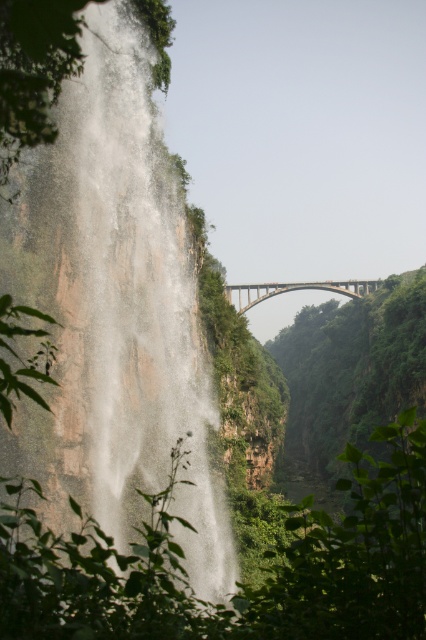
Question: Does white misty waterfall at left appear over brown concrete arch bridge at center?

Choices:
 (A) yes
 (B) no

Answer: (B)

Question: Which point is farther from the camera taking this photo?

Choices:
 (A) (354, 292)
 (B) (213, 502)

Answer: (A)

Question: Which of the following is the closest to the observer?

Choices:
 (A) brown concrete arch bridge at center
 (B) white misty waterfall at left

Answer: (B)

Question: Can you confirm if white misty waterfall at left is bigger than brown concrete arch bridge at center?

Choices:
 (A) no
 (B) yes

Answer: (B)

Question: Is white misty waterfall at left bigger than brown concrete arch bridge at center?

Choices:
 (A) yes
 (B) no

Answer: (A)